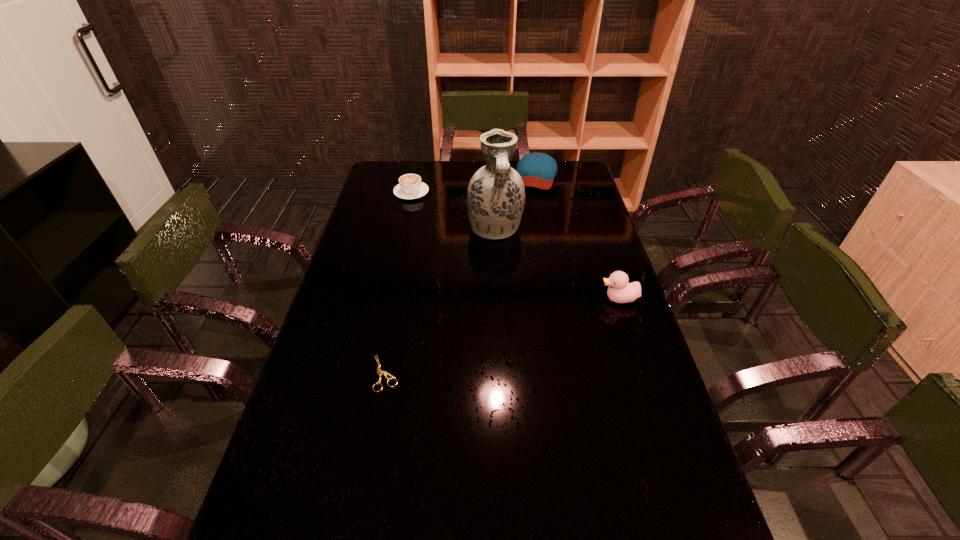
The height and width of the screenshot is (540, 960). Find the location of `vacant space positioned 0.310m on the front-facing side of the fourth shortest object`. vacant space positioned 0.310m on the front-facing side of the fourth shortest object is located at coordinates (499, 299).

You are a GUI agent. You are given a task and a screenshot of the screen. Output one action in this format:
    pyautogui.click(x=<x>, y=<y>)
    Task: Click on the free space located on the front-facing side of the fourth shortest object
    The width and height of the screenshot is (960, 540).
    Given the screenshot: What is the action you would take?
    pyautogui.click(x=487, y=299)

I want to click on free space located with the handle on the side of the third nearest object, so click(509, 272).

Locate an element on the screen. Image resolution: width=960 pixels, height=540 pixels. vacant space located 0.400m with the handle on the side of the third nearest object is located at coordinates (528, 333).

Where is `free space located with the handle on the side of the third nearest object`? free space located with the handle on the side of the third nearest object is located at coordinates (509, 273).

At what (x,y) coordinates should I click in order to perform the action: click on vacant region located with the bill of the third tallest object facing forward. Please return your answer as a coordinate pair (x, y). This screenshot has width=960, height=540. Looking at the image, I should click on (529, 200).

In order to click on vacant space located with the bill of the third tallest object facing forward in this screenshot , I will do `click(523, 218)`.

Where is `blank space located with the bill of the third tallest object facing forward`? The image size is (960, 540). blank space located with the bill of the third tallest object facing forward is located at coordinates (524, 217).

You are a GUI agent. You are given a task and a screenshot of the screen. Output one action in this format:
    pyautogui.click(x=<x>, y=<y>)
    Task: Click on the free location located on the side of the cappuccino with the handle
    The image size is (960, 540).
    Given the screenshot: What is the action you would take?
    pyautogui.click(x=466, y=248)

Locate an element on the screen. vacant region located 0.260m on the side of the cappuccino with the handle is located at coordinates (450, 233).